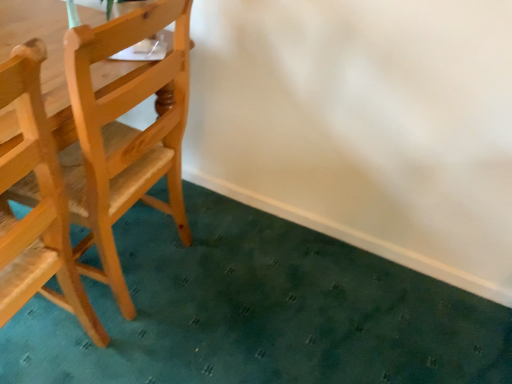
Question: Considering the positions of natural wood chair at left, the 2th chair viewed from the left, and light brown wood chair at left, acting as the 1th chair starting from the left, in the image, is natural wood chair at left, the 2th chair viewed from the left, taller or shorter than light brown wood chair at left, acting as the 1th chair starting from the left,?

Choices:
 (A) tall
 (B) short

Answer: (B)

Question: From a real-world perspective, is natural wood chair at left, the 2th chair viewed from the left, positioned above or below light brown wood chair at left, acting as the 1th chair starting from the left?

Choices:
 (A) below
 (B) above

Answer: (B)

Question: Does point (74, 145) appear closer or farther from the camera than point (17, 231)?

Choices:
 (A) closer
 (B) farther

Answer: (B)

Question: From a real-world perspective, is light brown wood chair at left, acting as the 1th chair starting from the left, above or below natural wood chair at left, the 2th chair viewed from the left?

Choices:
 (A) above
 (B) below

Answer: (B)

Question: Based on their positions, is light brown wood chair at left, arranged as the second chair when viewed from the right, located to the left or right of natural wood chair at left, acting as the first chair starting from the right?

Choices:
 (A) left
 (B) right

Answer: (A)

Question: Is light brown wood chair at left, acting as the 1th chair starting from the left, spatially inside natural wood chair at left, acting as the first chair starting from the right, or outside of it?

Choices:
 (A) outside
 (B) inside

Answer: (A)

Question: Is light brown wood chair at left, acting as the 1th chair starting from the left, taller or shorter than natural wood chair at left, the 2th chair viewed from the left?

Choices:
 (A) short
 (B) tall

Answer: (B)